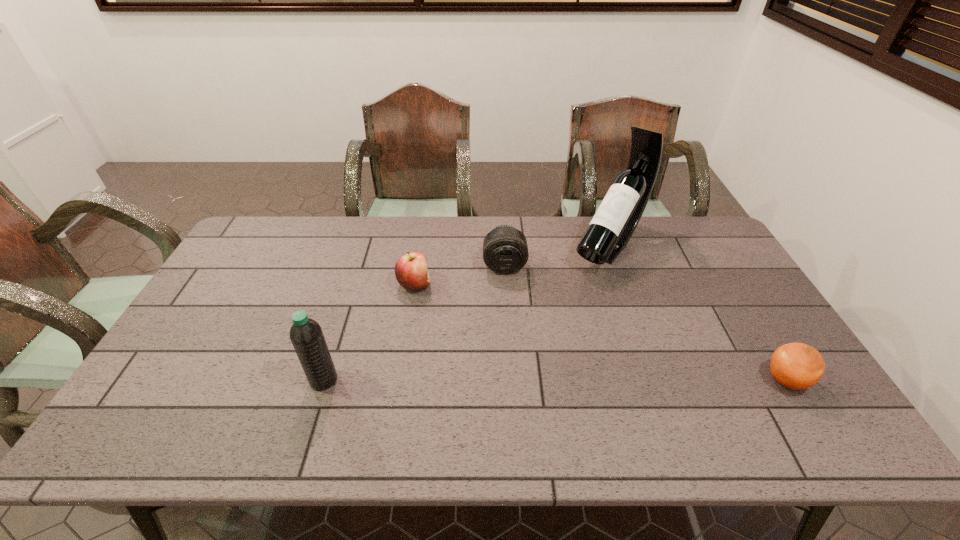
The width and height of the screenshot is (960, 540). In order to click on wine bottle located in the far edge section of the desktop in this screenshot , I will do `click(617, 217)`.

Locate an element on the screen. Image resolution: width=960 pixels, height=540 pixels. water bottle located in the near edge section of the desktop is located at coordinates (306, 335).

Locate an element on the screen. orange that is at the near edge is located at coordinates (798, 366).

You are a GUI agent. You are given a task and a screenshot of the screen. Output one action in this format:
    pyautogui.click(x=<x>, y=<y>)
    Task: Click on the object located at the right edge
    The image size is (960, 540).
    Given the screenshot: What is the action you would take?
    pyautogui.click(x=798, y=366)

This screenshot has height=540, width=960. What are the coordinates of `object at the near right corner` in the screenshot? It's located at (798, 366).

Where is `free region at the far edge of the desktop`? The image size is (960, 540). free region at the far edge of the desktop is located at coordinates (315, 222).

In order to click on free point at the near edge in this screenshot , I will do `click(708, 406)`.

The width and height of the screenshot is (960, 540). I want to click on vacant space at the far left corner of the desktop, so click(278, 241).

In the image, there is a desktop. Where is `blank space at the near left corner`? The height and width of the screenshot is (540, 960). blank space at the near left corner is located at coordinates (185, 404).

Identify the location of vacant region at the far right corner of the desktop. (686, 232).